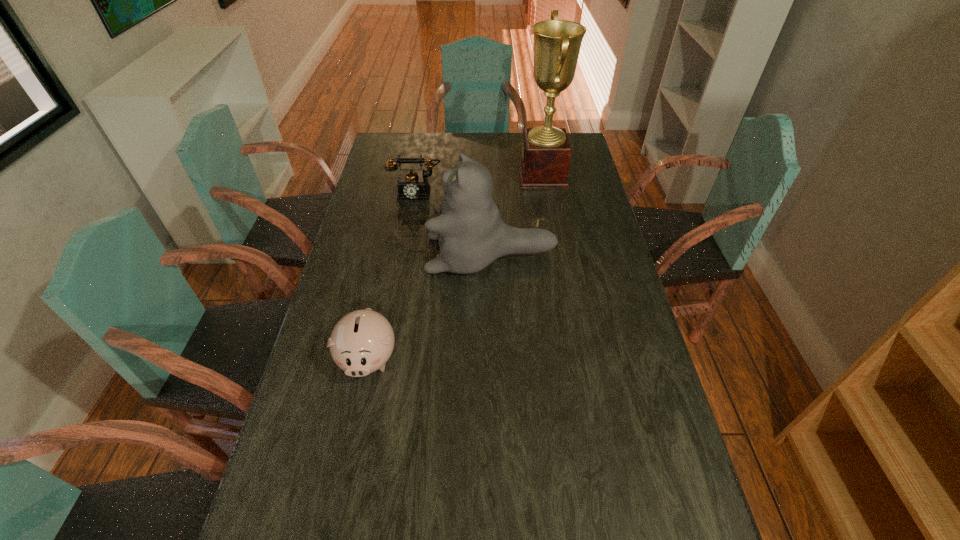
In order to click on the tallest object in this screenshot , I will do [x=545, y=156].

The image size is (960, 540). Identify the location of the second nearest object. (471, 233).

This screenshot has height=540, width=960. I want to click on cat, so (471, 233).

This screenshot has width=960, height=540. Identify the location of telephone. (411, 185).

Identify the location of the nearest object. (362, 341).

Identify the location of vacant space situated on the plaque of the tallest object. The height and width of the screenshot is (540, 960). (427, 174).

You are a GUI agent. You are given a task and a screenshot of the screen. Output one action in this format:
    pyautogui.click(x=<x>, y=<y>)
    Task: Click on the free space located on the plaque of the tallest object
    
    Given the screenshot: What is the action you would take?
    pyautogui.click(x=500, y=174)

Where is `vacant space positioned on the plaque of the tallest object`? The height and width of the screenshot is (540, 960). vacant space positioned on the plaque of the tallest object is located at coordinates (466, 174).

I want to click on vacant space situated on the face of the third shortest object, so click(399, 254).

This screenshot has width=960, height=540. Find the location of `blank space located 0.090m on the face of the third shortest object`. blank space located 0.090m on the face of the third shortest object is located at coordinates (399, 254).